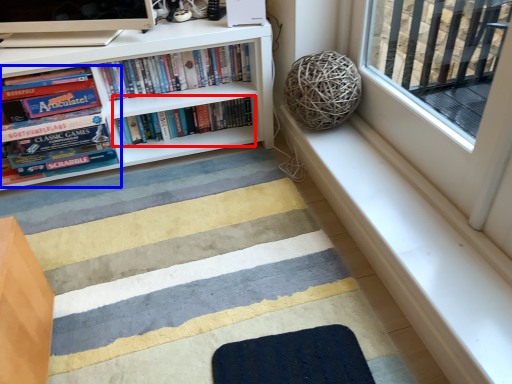
Question: Which object is closer to the camera taking this photo, book (highlighted by a red box) or book (highlighted by a blue box)?

Choices:
 (A) book
 (B) book

Answer: (B)